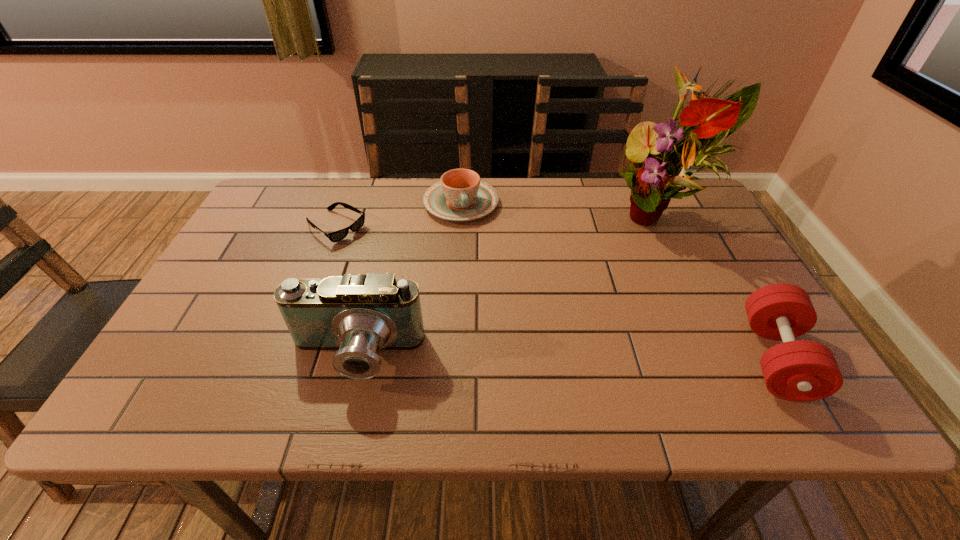
You are a GUI agent. You are given a task and a screenshot of the screen. Output one action in this format:
    pyautogui.click(x=<x>, y=<y>)
    Task: Click on the vacant space on the desktop that is between the fourth shortest object and the dumbbell and is positioned on the front-facing side of the tallest object
    The width and height of the screenshot is (960, 540).
    Given the screenshot: What is the action you would take?
    pyautogui.click(x=507, y=357)

Image resolution: width=960 pixels, height=540 pixels. In order to click on free space on the desktop that is between the camcorder and the third tallest object and is positioned on the handle side of the second shortest object in this screenshot , I will do `click(507, 357)`.

The width and height of the screenshot is (960, 540). I want to click on vacant space on the desktop that is between the camcorder and the dumbbell and is positioned on the front-facing side of the sunglasses, so click(538, 357).